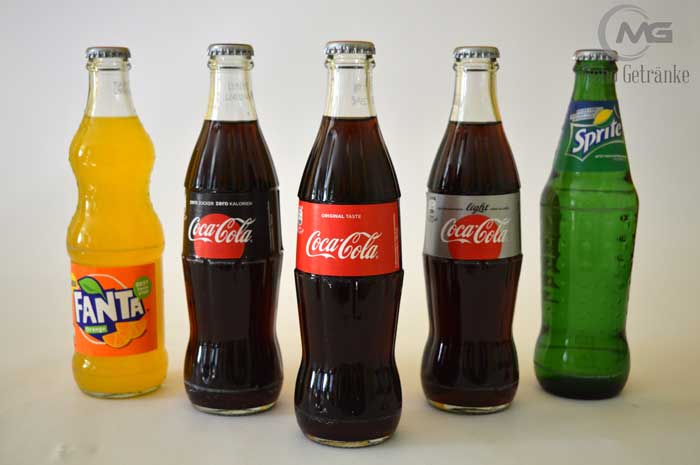
The width and height of the screenshot is (700, 465). In order to click on glass soda bottles in this screenshot , I will do `click(111, 254)`, `click(225, 255)`, `click(346, 265)`, `click(477, 264)`, `click(581, 267)`.